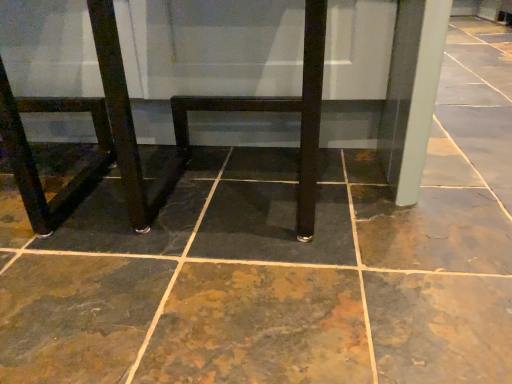
Where is `brown stone floor at center`? The height and width of the screenshot is (384, 512). brown stone floor at center is located at coordinates (264, 280).

What do you see at coordinates (173, 128) in the screenshot?
I see `matte black table at center` at bounding box center [173, 128].

What do you see at coordinates (95, 133) in the screenshot? Image resolution: width=512 pixels, height=384 pixels. I see `matte black chair at lower left` at bounding box center [95, 133].

Where is `brown stone floor at center`? The width and height of the screenshot is (512, 384). brown stone floor at center is located at coordinates (264, 280).

Based on the photo, choose the correct answer: Is brown stone floor at center inside matte black table at center or outside it?

brown stone floor at center is spatially situated outside matte black table at center.

Considering the positions of objects brown stone floor at center and matte black table at center in the image provided, who is more to the left, brown stone floor at center or matte black table at center?

Positioned to the left is matte black table at center.

How distant is brown stone floor at center from matte black table at center?

brown stone floor at center is 16.44 centimeters from matte black table at center.

Is brown stone floor at center smaller than matte black table at center?

Yes.

Does point (71, 111) come closer to viewer compared to point (113, 301)?

No.

Between matte black chair at lower left and brown stone floor at center, which one has smaller size?

With smaller size is matte black chair at lower left.

Can you tell me how much matte black chair at lower left and brown stone floor at center differ in facing direction?

The facing directions of matte black chair at lower left and brown stone floor at center are 1.74 degrees apart.

Between matte black chair at lower left and brown stone floor at center, which one has less height?

Standing shorter between the two is brown stone floor at center.

In the scene shown: From the image's perspective, between brown stone floor at center and matte black chair at lower left, who is located below?

brown stone floor at center, from the image's perspective.

Which point is more forward, (313, 370) or (114, 143)?

The point (313, 370) is in front.

Which of these two, brown stone floor at center or matte black chair at lower left, is bigger?

Bigger between the two is brown stone floor at center.

Is matte black chair at lower left thinner than matte black table at center?

Correct, the width of matte black chair at lower left is less than that of matte black table at center.

Which is farther, (x=46, y=98) or (x=91, y=109)?

The point (x=46, y=98) is behind.

From a real-world perspective, between matte black table at center and brown stone floor at center, who is vertically lower?

brown stone floor at center is physically lower.

In the scene shown: Is matte black table at center thinner than brown stone floor at center?

In fact, matte black table at center might be wider than brown stone floor at center.

This screenshot has width=512, height=384. Find the location of `furniture that appears above the brown stone floor at center (from the image's perspective)`. furniture that appears above the brown stone floor at center (from the image's perspective) is located at coordinates (173, 128).

Does matte black table at center come behind brown stone floor at center?

Yes, the depth of matte black table at center is greater than that of brown stone floor at center.

This screenshot has width=512, height=384. I want to click on chair that appears above the matte black table at center (from a real-world perspective), so click(x=95, y=133).

Could you tell me if matte black table at center is facing matte black chair at lower left?

No, matte black table at center is not facing towards matte black chair at lower left.

Choose the correct answer: Is matte black table at center inside matte black chair at lower left or outside it?

matte black table at center lies outside matte black chair at lower left.

Would you consider matte black table at center to be distant from matte black chair at lower left?

Actually, matte black table at center and matte black chair at lower left are a little close together.

Find the location of a particular element. This screenshot has height=384, width=512. furniture above the brown stone floor at center (from a real-world perspective) is located at coordinates (173, 128).

This screenshot has width=512, height=384. I want to click on concrete below the matte black chair at lower left (from a real-world perspective), so click(x=264, y=280).

Estimate the real-world distances between objects in this image. Which object is further from matte black table at center, brown stone floor at center or matte black chair at lower left?

brown stone floor at center lies further to matte black table at center than the other object.

Looking at the image, which one is located closer to brown stone floor at center, matte black chair at lower left or matte black table at center?

matte black table at center is positioned closer to the anchor brown stone floor at center.

Looking at this image, when comparing their distances from matte black chair at lower left, does brown stone floor at center or matte black table at center seem further?

brown stone floor at center is further to matte black chair at lower left.

Which object lies further to the anchor point brown stone floor at center, matte black table at center or matte black chair at lower left?

Based on the image, matte black chair at lower left appears to be further to brown stone floor at center.

Considering their positions, is matte black table at center positioned further to matte black chair at lower left than brown stone floor at center?

brown stone floor at center lies further to matte black chair at lower left than the other object.

Considering their positions, is matte black chair at lower left positioned further to matte black table at center than brown stone floor at center?

brown stone floor at center is positioned further to the anchor matte black table at center.

This screenshot has width=512, height=384. I want to click on furniture between matte black chair at lower left and brown stone floor at center, so click(x=173, y=128).